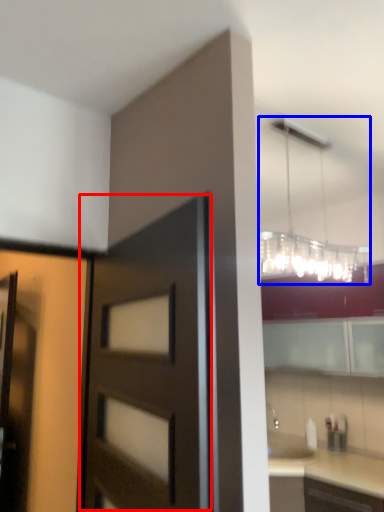
Question: Which point is closer to the camera, door (highlighted by a red box) or lamp (highlighted by a blue box)?

Choices:
 (A) door
 (B) lamp

Answer: (A)